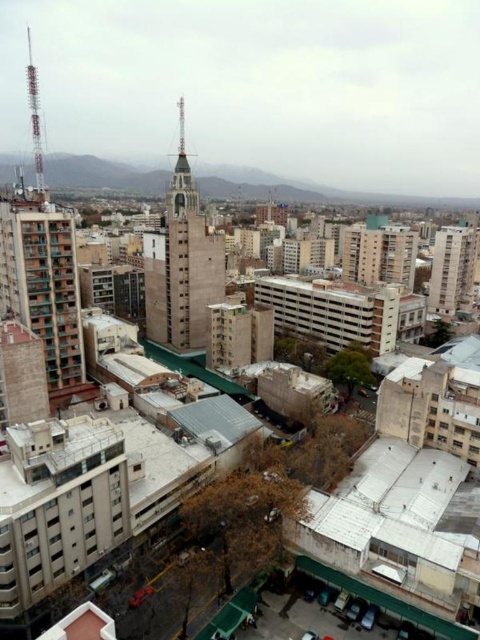
You are standing at the base of the green concrete building at left. You want to walk to the nearest building that is part of the midground cluster. How far will you have to walk?

The green concrete building at left is 118.41 meters from viewer, so you will have to walk 118.41 meters to reach the nearest building in the midground cluster.

You are an urban planner assessing building dimensions. Given the concrete tower at center and the smooth concrete building at upper right, which one has a greater width?

The concrete tower at center has a greater width than the smooth concrete building at upper right.

You are an architect analyzing the urban layout. Based on the scene, which of the two structures, the green concrete building at left or the concrete tower at center, would require a taller crane for construction? Explain your reasoning using their relative heights.

The concrete tower at center requires a taller crane because it is taller than the green concrete building at left, as stated in the description.